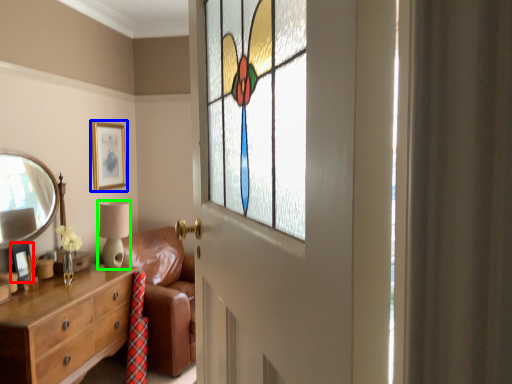
Question: Which object is positioned farthest from picture frame (highlighted by a red box)? Select from picture frame (highlighted by a blue box) and table lamp (highlighted by a green box).

Choices:
 (A) picture frame
 (B) table lamp

Answer: (A)